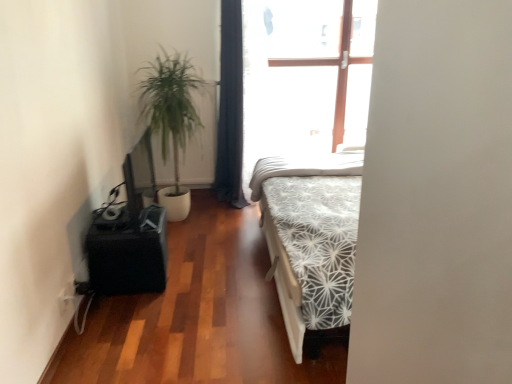
Where is `free location in front of black matte table at left`? free location in front of black matte table at left is located at coordinates (134, 310).